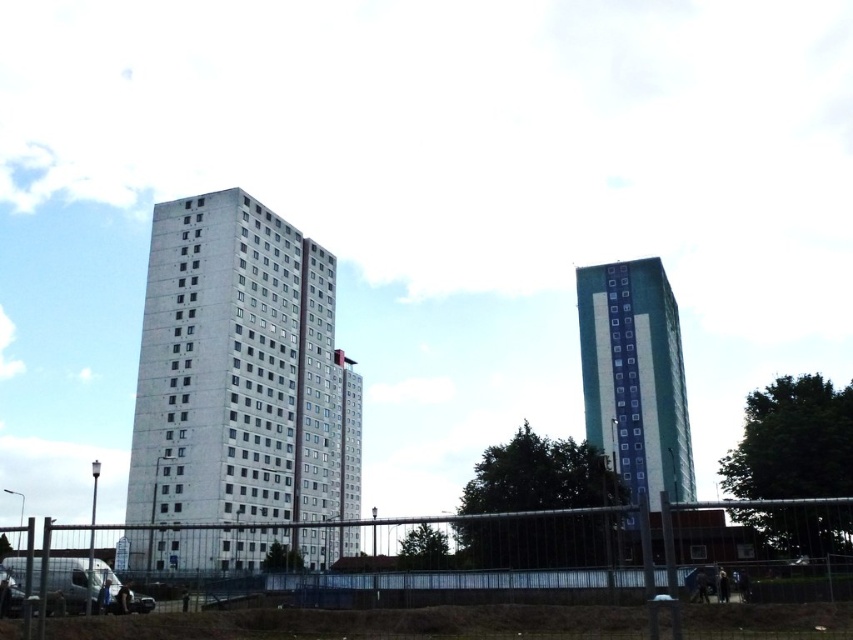
Who is taller, metal fence at lower center or teal glass tower at right?

teal glass tower at right is taller.

From the picture: Between metal fence at lower center and teal glass tower at right, which one is positioned lower?

Positioned lower is metal fence at lower center.

Measure the distance between metal fence at lower center and camera.

They are 8.86 meters apart.

Image resolution: width=853 pixels, height=640 pixels. What are the coordinates of `metal fence at lower center` in the screenshot? It's located at (569, 552).

Is the position of concrete building at center more distant than that of metal fence at lower center?

Yes, it is behind metal fence at lower center.

Is concrete building at center shorter than metal fence at lower center?

No.

Which is in front, point (209, 248) or point (654, 556)?

Point (654, 556) is in front.

Where is `concrete building at center`? The image size is (853, 640). concrete building at center is located at coordinates (241, 372).

Can you confirm if concrete building at center is shorter than teal glass tower at right?

No.

Which is behind, point (229, 467) or point (582, 365)?

Point (582, 365)

What do you see at coordinates (241, 372) in the screenshot?
I see `concrete building at center` at bounding box center [241, 372].

You are a GUI agent. You are given a task and a screenshot of the screen. Output one action in this format:
    pyautogui.click(x=<x>, y=<y>)
    Task: Click on the concrete building at center
    This screenshot has width=853, height=640.
    Given the screenshot: What is the action you would take?
    pyautogui.click(x=241, y=372)